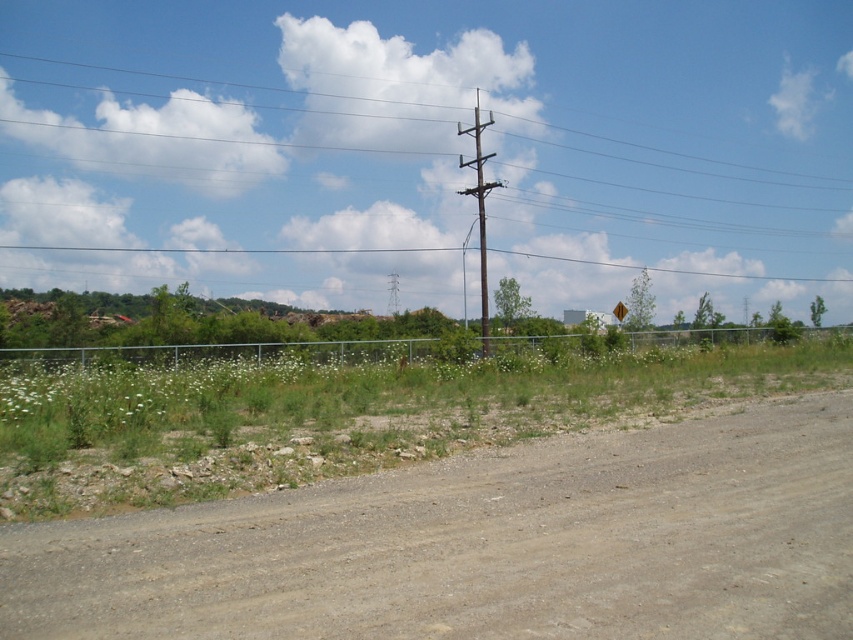
Question: Is brown gravel dirt track at lower left positioned in front of silver metallic fence at center?

Choices:
 (A) yes
 (B) no

Answer: (A)

Question: Considering the real-world distances, which object is farthest from the yellow reflective plastic at right?

Choices:
 (A) silver metallic fence at center
 (B) brown wooden pole at upper center
 (C) brown wooden telegraph pole at center

Answer: (B)

Question: Which of the following is the closest to the observer?

Choices:
 (A) brown wooden pole at upper center
 (B) brown wooden telegraph pole at center
 (C) silver metallic fence at center
 (D) brown gravel dirt track at lower left

Answer: (D)

Question: Does silver metallic fence at center lie in front of yellow reflective plastic at right?

Choices:
 (A) yes
 (B) no

Answer: (A)

Question: Is brown wooden pole at upper center below yellow reflective plastic at right?

Choices:
 (A) yes
 (B) no

Answer: (B)

Question: Estimate the real-world distances between objects in this image. Which object is farther from the brown wooden pole at upper center?

Choices:
 (A) brown gravel dirt track at lower left
 (B) silver metallic fence at center
 (C) brown wooden telegraph pole at center
 (D) yellow reflective plastic at right

Answer: (A)